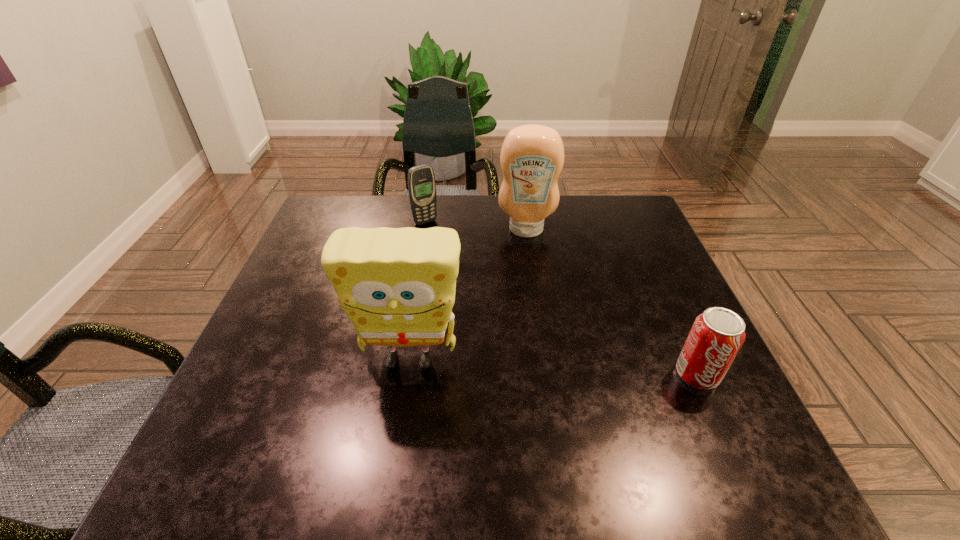
This screenshot has width=960, height=540. I want to click on free space located on the label of the third object from left to right, so click(525, 258).

This screenshot has height=540, width=960. What are the coordinates of `free region located 0.120m on the label of the third object from left to right` in the screenshot? It's located at (526, 267).

The width and height of the screenshot is (960, 540). Identify the location of blank area located 0.360m on the label of the third object from left to right. (526, 339).

Find the location of `cellular telephone present at the far edge`. cellular telephone present at the far edge is located at coordinates (421, 181).

Find the location of a particular element. condiment that is at the far edge is located at coordinates (532, 156).

The width and height of the screenshot is (960, 540). Identify the location of object that is positioned at the near edge. coord(717,334).

The image size is (960, 540). Find the location of `object at the right edge`. object at the right edge is located at coordinates (717, 334).

The image size is (960, 540). In order to click on object that is at the near right corner in this screenshot , I will do `click(717, 334)`.

Locate an element on the screen. This screenshot has width=960, height=540. free space at the far edge of the desktop is located at coordinates (560, 202).

Locate an element on the screen. Image resolution: width=960 pixels, height=540 pixels. vacant space at the near edge of the desktop is located at coordinates (434, 409).